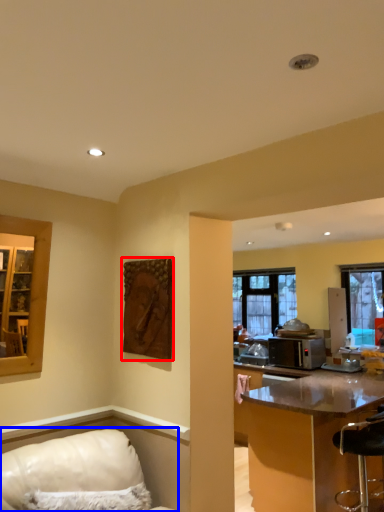
Question: Which point is further to the camera, picture frame (highlighted by a red box) or furniture (highlighted by a blue box)?

Choices:
 (A) picture frame
 (B) furniture

Answer: (A)